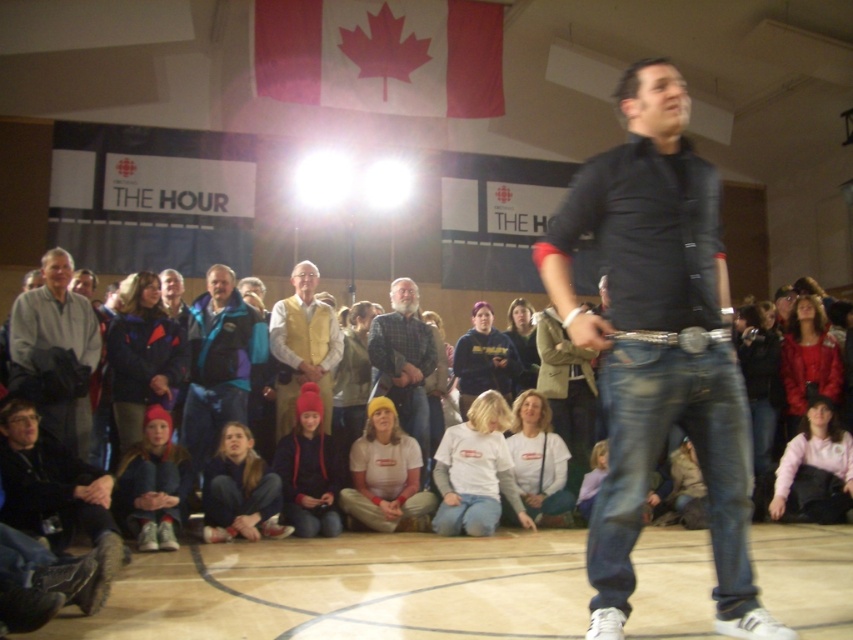
Who is taller, blue fleece jacket at center or pink fleece jacket at lower right?

Standing taller between the two is blue fleece jacket at center.

How far apart are blue fleece jacket at center and pink fleece jacket at lower right?

blue fleece jacket at center is 5.12 meters from pink fleece jacket at lower right.

Identify the location of blue fleece jacket at center. The image size is (853, 640). (219, 362).

Locate an element on the screen. The height and width of the screenshot is (640, 853). blue fleece jacket at center is located at coordinates (219, 362).

Can you confirm if blue fleece jacket at lower left is smaller than red knit hat at lower left?

No.

Which is behind, point (160, 310) or point (157, 474)?

Positioned behind is point (160, 310).

The image size is (853, 640). I want to click on blue fleece jacket at lower left, so click(x=142, y=355).

This screenshot has height=640, width=853. What do you see at coordinates (241, 490) in the screenshot? I see `denim pants at lower left` at bounding box center [241, 490].

Is denim pants at lower left below light brown knit hat at center?

Correct, denim pants at lower left is located below light brown knit hat at center.

Between point (228, 460) and point (521, 380), which one is positioned in front?

Positioned in front is point (228, 460).

The height and width of the screenshot is (640, 853). What are the coordinates of `denim pants at lower left` in the screenshot? It's located at (241, 490).